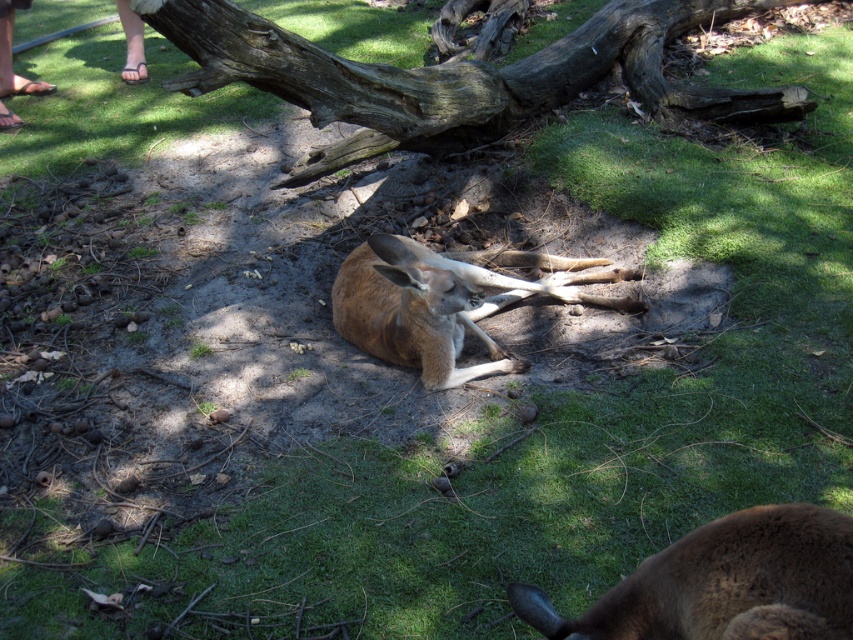
Does brown furry kangaroo at lower right appear on the left side of brown furry kangaroo at center?

Incorrect, brown furry kangaroo at lower right is not on the left side of brown furry kangaroo at center.

Does point (610, 636) come in front of point (364, 330)?

Yes.

Image resolution: width=853 pixels, height=640 pixels. Find the location of `brown furry kangaroo at lower right`. brown furry kangaroo at lower right is located at coordinates (723, 582).

Who is higher up, dark brown wood at upper center or brown furry kangaroo at center?

dark brown wood at upper center

Is point (207, 52) positioned in front of point (408, 305)?

No.

Who is more distant from viewer, (350, 120) or (361, 304)?

The point (350, 120) is more distant.

Where is `dark brown wood at upper center`? The width and height of the screenshot is (853, 640). dark brown wood at upper center is located at coordinates (457, 76).

Does dark brown wood at upper center have a lesser width compared to brown furry kangaroo at lower right?

Incorrect, dark brown wood at upper center's width is not less than brown furry kangaroo at lower right's.

Where is `dark brown wood at upper center`? dark brown wood at upper center is located at coordinates (457, 76).

I want to click on dark brown wood at upper center, so click(457, 76).